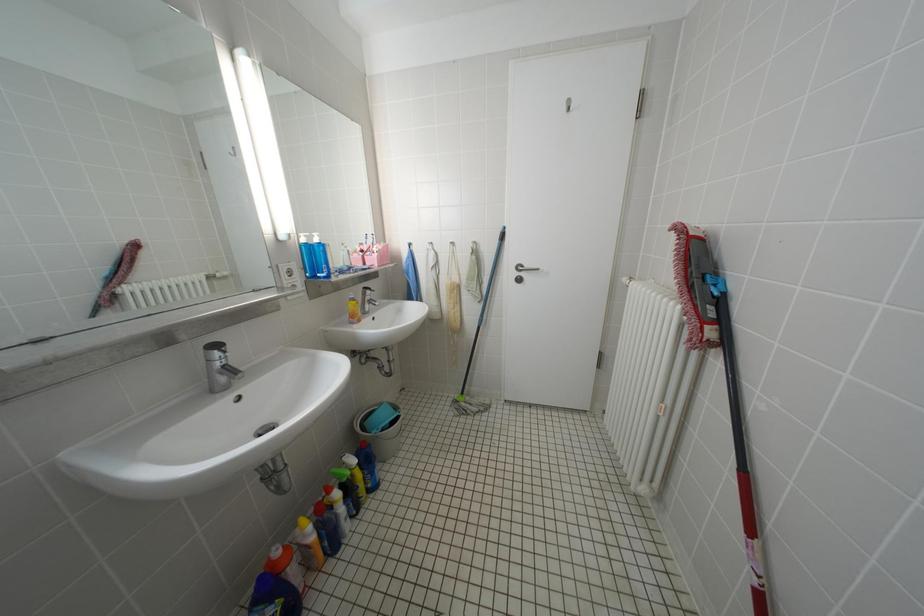
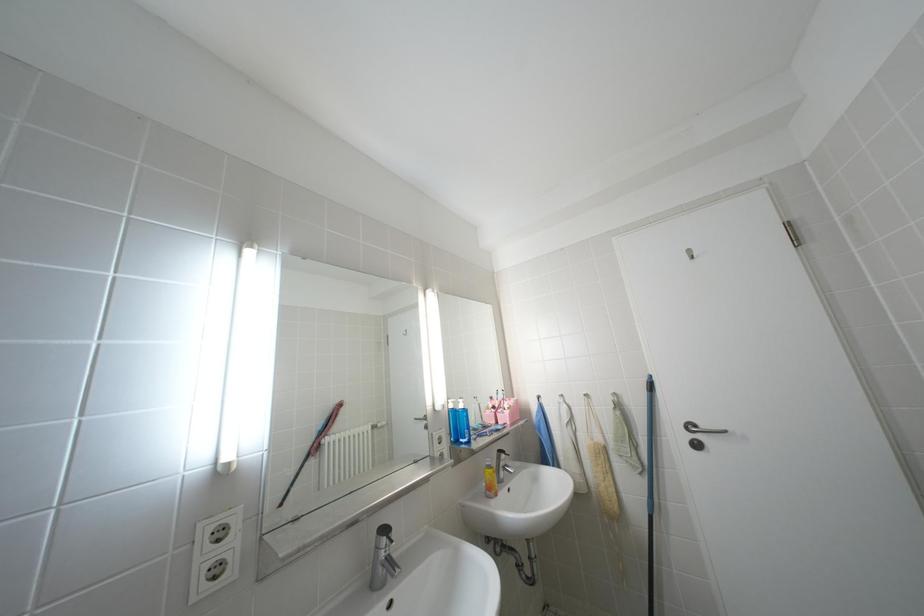
Looking at this image, the first image is from the beginning of the video and the second image is from the end. How did the camera likely rotate when shooting the video?

The camera rotated toward left-up.